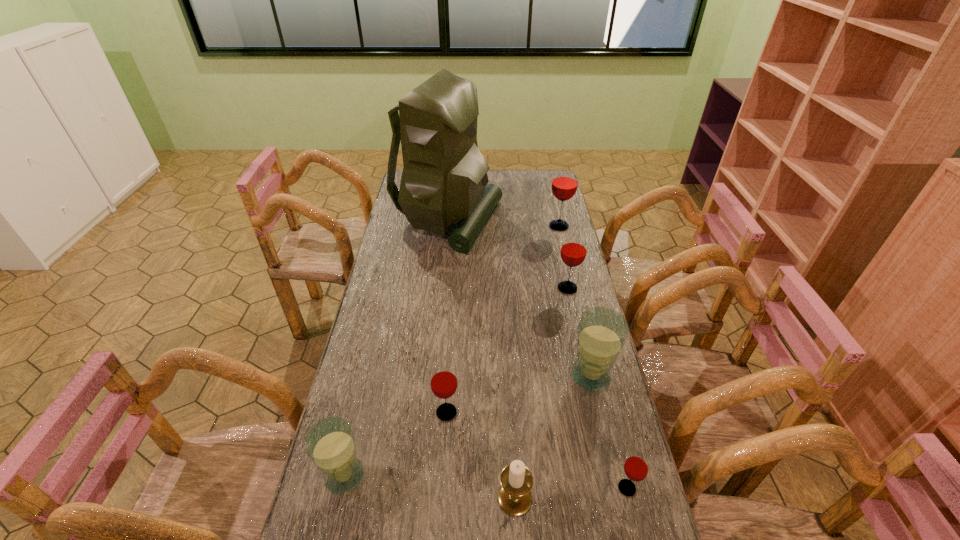
Identify the location of vacant space located on the right of the leftmost glass. (390, 476).

Identify the location of free space located 0.370m on the left of the white candle holder. The width and height of the screenshot is (960, 540). (341, 498).

Find the location of a particular element. free space located on the front of the nearest red glass is located at coordinates (636, 527).

I want to click on object present at the far edge, so click(x=444, y=180).

Locate an element on the screen. The width and height of the screenshot is (960, 540). backpack that is at the left edge is located at coordinates (444, 180).

Find the location of a particular element. Image resolution: width=960 pixels, height=540 pixels. glass situated at the left edge is located at coordinates (330, 444).

Find the location of a particular element. This screenshot has width=960, height=540. object at the far left corner is located at coordinates (444, 180).

Image resolution: width=960 pixels, height=540 pixels. Identify the location of free space at the left edge. (365, 339).

Locate an element on the screen. This screenshot has height=540, width=960. vacant space at the right edge of the desktop is located at coordinates (550, 307).

The width and height of the screenshot is (960, 540). Identify the location of vacant space that is in between the leftmost glass and the white candle holder. (429, 487).